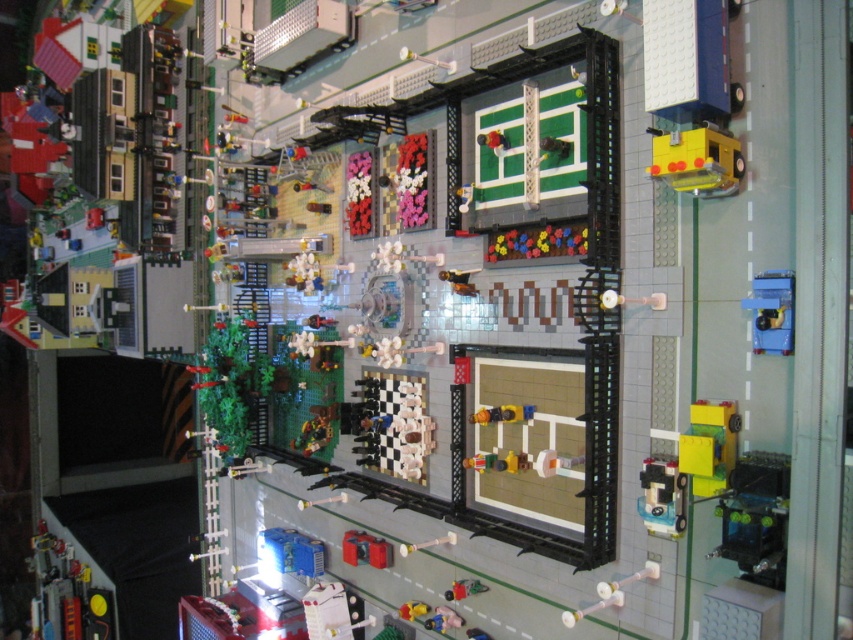
Who is more distant from viewer, (532, 410) or (447, 593)?

The point (447, 593) is behind.

Which is in front, point (476, 413) or point (460, 592)?

Point (476, 413)

Where is `yellow plastic figure at center`? Image resolution: width=853 pixels, height=640 pixels. yellow plastic figure at center is located at coordinates (502, 413).

Does blue plastic car at right appear over translucent plastic car at lower right?

Yes.

This screenshot has width=853, height=640. Describe the element at coordinates (770, 310) in the screenshot. I see `blue plastic car at right` at that location.

Where is `blue plastic car at right`? blue plastic car at right is located at coordinates (770, 310).

Between translucent plastic car at lower right and metallic silver car at bottom center, which one is positioned lower?

metallic silver car at bottom center is below.

Between translucent plastic car at lower right and metallic silver car at bottom center, which one appears on the right side from the viewer's perspective?

From the viewer's perspective, translucent plastic car at lower right appears more on the right side.

Where is `translucent plastic car at lower right`? This screenshot has height=640, width=853. translucent plastic car at lower right is located at coordinates (662, 496).

Find the location of a particular element. The width and height of the screenshot is (853, 640). translucent plastic car at lower right is located at coordinates (662, 496).